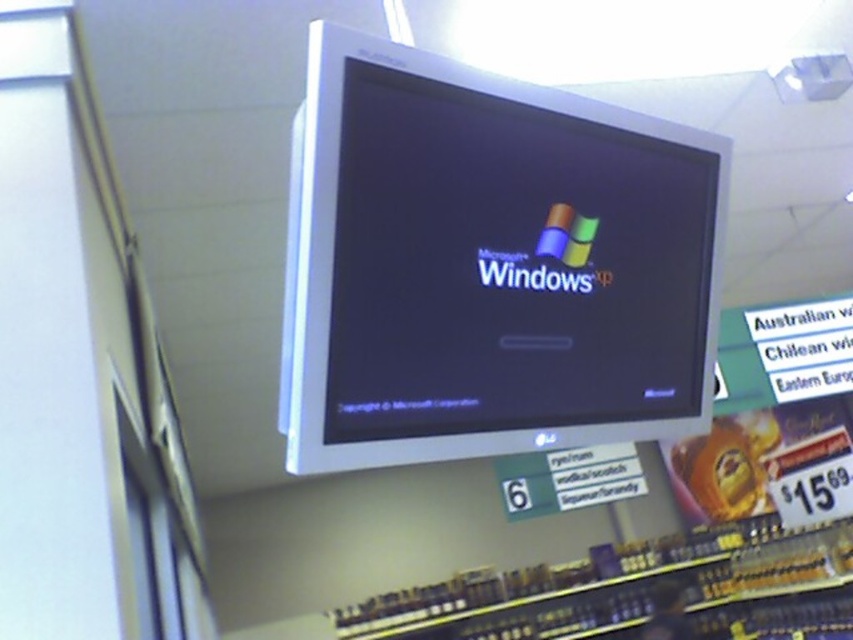
Which is below, satin silver monitor at center or metallic silver shelves at lower center?

metallic silver shelves at lower center

Is point (453, 284) more distant than point (666, 573)?

No, (453, 284) is in front of (666, 573).

This screenshot has width=853, height=640. What are the coordinates of `satin silver monitor at center` in the screenshot? It's located at (492, 264).